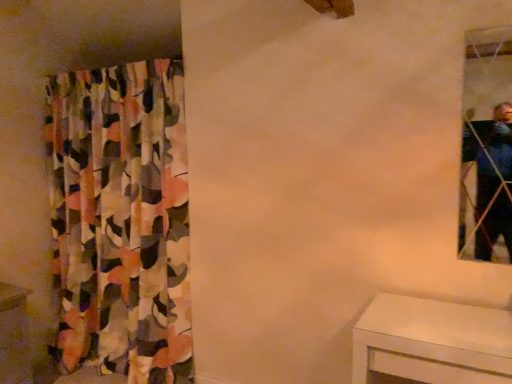
Question: Is there a large distance between white glossy vanity at lower left and clear glass mirror at upper right?

Choices:
 (A) yes
 (B) no

Answer: (A)

Question: Is white glossy vanity at lower left positioned before clear glass mirror at upper right?

Choices:
 (A) yes
 (B) no

Answer: (B)

Question: Can we say white glossy vanity at lower left lies outside clear glass mirror at upper right?

Choices:
 (A) no
 (B) yes

Answer: (B)

Question: Is white glossy vanity at lower left oriented towards clear glass mirror at upper right?

Choices:
 (A) no
 (B) yes

Answer: (B)

Question: Considering the relative sizes of white glossy vanity at lower left and clear glass mirror at upper right in the image provided, is white glossy vanity at lower left thinner than clear glass mirror at upper right?

Choices:
 (A) yes
 (B) no

Answer: (B)

Question: Is the position of white glossy vanity at lower left more distant than that of clear glass mirror at upper right?

Choices:
 (A) no
 (B) yes

Answer: (B)

Question: Can you confirm if multicolored fabric curtain at left is taller than clear glass mirror at upper right?

Choices:
 (A) no
 (B) yes

Answer: (B)

Question: Can you confirm if multicolored fabric curtain at left is positioned to the left of clear glass mirror at upper right?

Choices:
 (A) no
 (B) yes

Answer: (B)

Question: Is multicolored fabric curtain at left wider than clear glass mirror at upper right?

Choices:
 (A) yes
 (B) no

Answer: (A)

Question: Is multicolored fabric curtain at left further to the viewer compared to clear glass mirror at upper right?

Choices:
 (A) yes
 (B) no

Answer: (A)

Question: Does multicolored fabric curtain at left turn towards clear glass mirror at upper right?

Choices:
 (A) no
 (B) yes

Answer: (A)

Question: Is multicolored fabric curtain at left bigger than clear glass mirror at upper right?

Choices:
 (A) yes
 (B) no

Answer: (A)

Question: From the image's perspective, is clear glass mirror at upper right under multicolored fabric curtain at left?

Choices:
 (A) no
 (B) yes

Answer: (A)